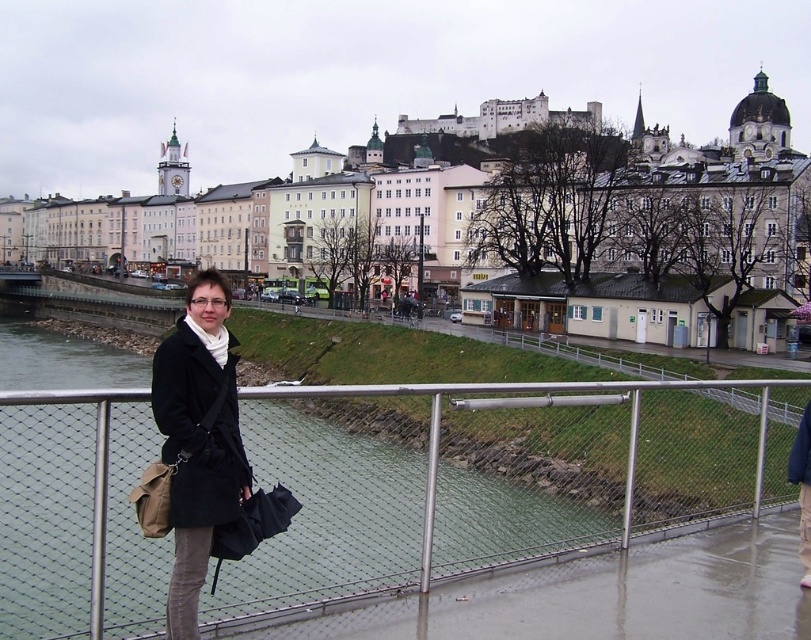
Based on the photo, you are a delivery person trying to see if you can pass through the space between the metal mesh fence at lower center and the black matte coat at center. Given that the fence is shorter than the coat, can you fit through without bending down?

The metal mesh fence at lower center has a lesser height compared to the black matte coat at center, so the fence is shorter than the coat. Since the fence is lower, you can likely pass through the space between them without bending down as the fence won not obstruct your height.

You are a tourist standing at the edge of the city park. You notice a metal mesh fence at lower center and a black matte coat at center. Which object is closer to your current position?

The metal mesh fence at lower center is closer to your current position because it is located below the black matte coat at center, indicating it is nearer in the scene.

You are a tourist standing in the city and see the metal mesh fence at lower center and the black matte coat at center. Which object is positioned to the right side from your perspective?

The metal mesh fence at lower center is to the right of the black matte coat at center, so the metal mesh fence at lower center is positioned to the right side from your perspective.